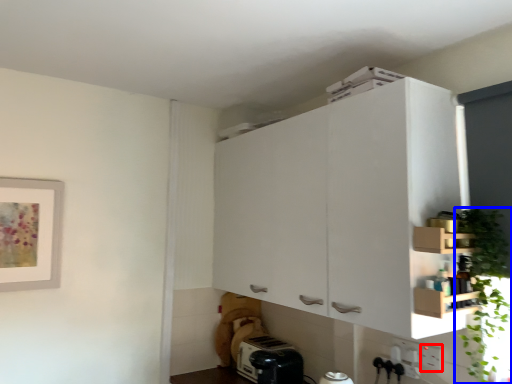
Question: Which object appears closest to the camera in this image, electric outlet (highlighted by a red box) or plant (highlighted by a blue box)?

Choices:
 (A) electric outlet
 (B) plant

Answer: (B)